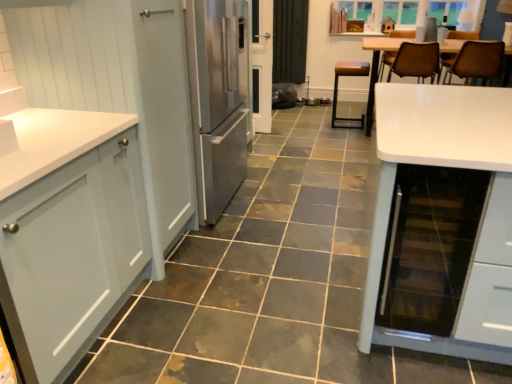
Identify the location of free space to the left of brown leather stool at center, acting as the third chair starting from the right. This screenshot has height=384, width=512. (316, 129).